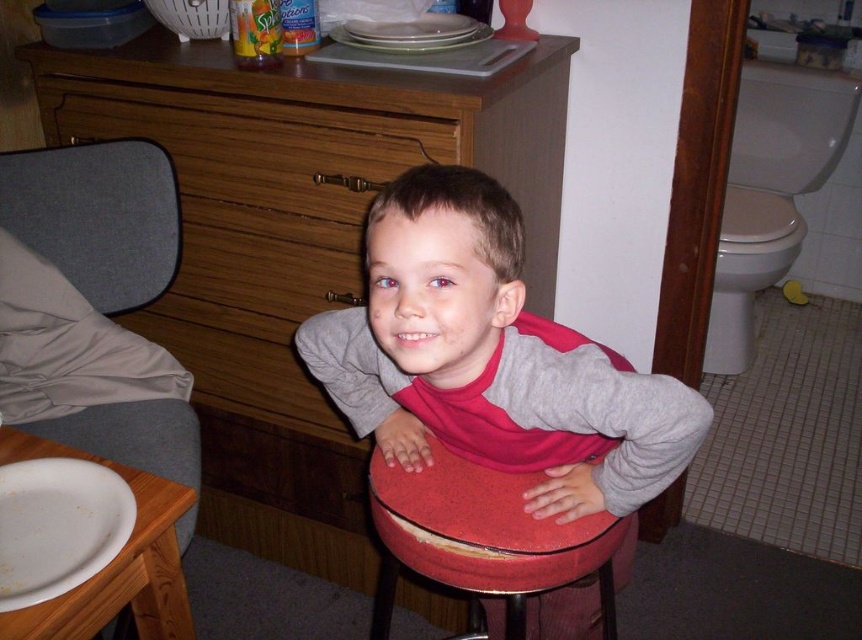
Question: Does matte wood dresser at center appear over gray fabric cushion at left?

Choices:
 (A) yes
 (B) no

Answer: (A)

Question: Which of these objects is positioned farthest from the matte red stool at center?

Choices:
 (A) red cushioned stool at center
 (B) gray fabric cushion at left
 (C) matte wood dresser at center

Answer: (B)

Question: Is white glossy toilet at right behind red cushioned stool at center?

Choices:
 (A) yes
 (B) no

Answer: (A)

Question: Which point is farther from the camera taking this photo?

Choices:
 (A) pos(554,380)
 (B) pos(339,88)

Answer: (B)

Question: Does matte wood dresser at center have a lesser width compared to red cushioned stool at center?

Choices:
 (A) yes
 (B) no

Answer: (B)

Question: Which point is closer to the camera?

Choices:
 (A) matte red stool at center
 (B) matte wood dresser at center
 (C) white glossy toilet at right

Answer: (A)